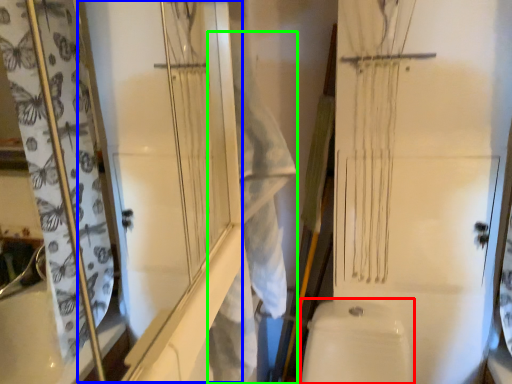
Question: Which object is the closest to the toilet bowl (highlighted by a red box)? Choose among these: screen door (highlighted by a blue box) or laundry (highlighted by a green box).

Choices:
 (A) screen door
 (B) laundry

Answer: (B)